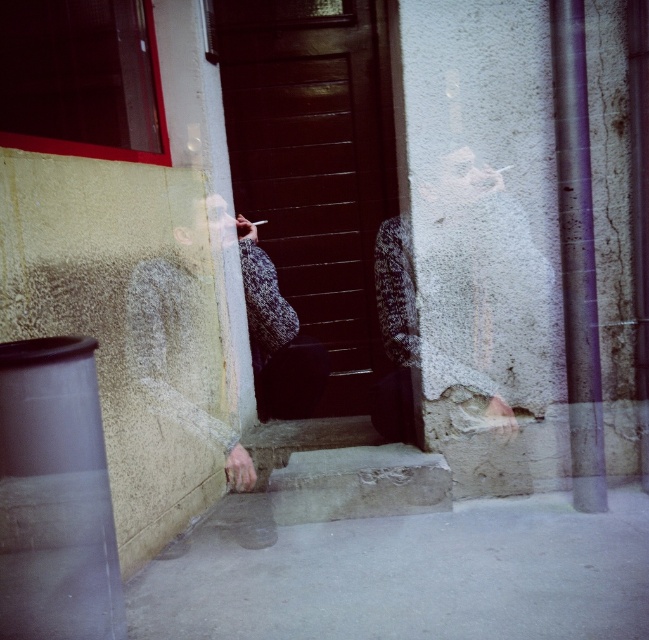
Question: Does matte gray cigarette at center appear on the left side of white matte cigarette at center?

Choices:
 (A) yes
 (B) no

Answer: (B)

Question: Is dark wood door at center wider than concrete textured stair at center?

Choices:
 (A) yes
 (B) no

Answer: (B)

Question: Which object is the farthest from the white matte cigarette at center?

Choices:
 (A) concrete textured stair at center
 (B) matte gray cigarette at center

Answer: (B)

Question: Does concrete textured stair at center appear on the right side of white matte cigarette at center?

Choices:
 (A) yes
 (B) no

Answer: (A)

Question: Which point is farther to the camera?

Choices:
 (A) white matte cigarette at center
 (B) matte gray cigarette at center

Answer: (A)

Question: Which object is farther from the camera taking this photo?

Choices:
 (A) dark wood door at center
 (B) matte gray cigarette at center

Answer: (A)